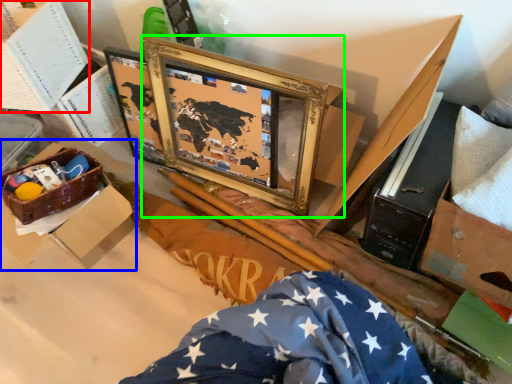
Question: Which object is positioned farthest from box (highlighted by a red box)? Select from box (highlighted by a blue box) and picture frame (highlighted by a green box).

Choices:
 (A) box
 (B) picture frame

Answer: (B)